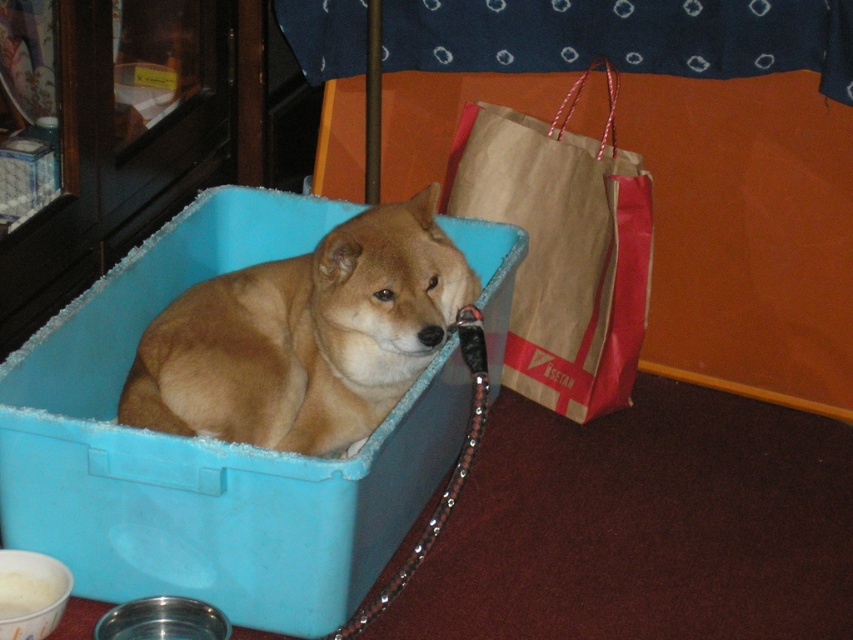
You need to place a new decorative item on the floor between the blue plastic box at center and the brown paper bag at right. Based on their positions, which object should the item be closer to?

The blue plastic box at center is positioned on the left side of the brown paper bag at right, so the new decorative item should be placed closer to the brown paper bag at right to maintain symmetry between the two objects.

You are a delivery person who needs to place a package on the floor next to the brown fur dog at center and the brown paper bag at right. Which object should you place the package closer to if you want it to be more visible to someone entering the room?

The brown paper bag at right is taller than the brown fur dog at center, so placing the package next to the brown paper bag at right would make it more visible to someone entering the room.

You are trying to place a new decorative item on the floor next to the blue plastic box at center. The coordinates of the available space are given as points. Which coordinate point would be the best fit for placing the item to ensure it is adjacent to the box?

The blue plastic box at center is located at point (207, 448). To place the decorative item adjacent to it, you should choose a coordinate point that is closest to this location, such as (207, 451) or (207, 444), ensuring it is next to the box without overlapping.